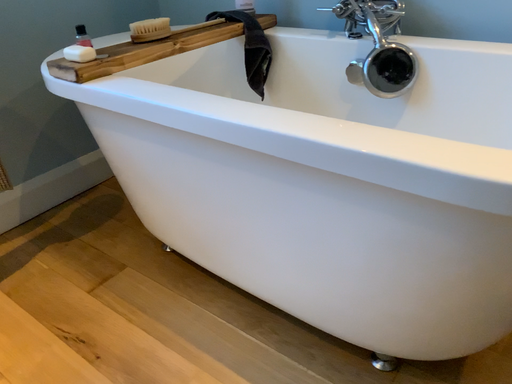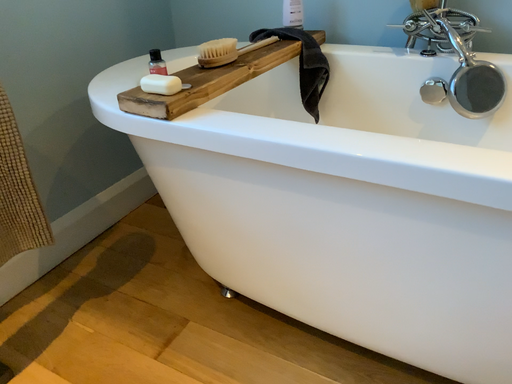
Question: Which way did the camera rotate in the video?

Choices:
 (A) rotated right
 (B) rotated left

Answer: (A)